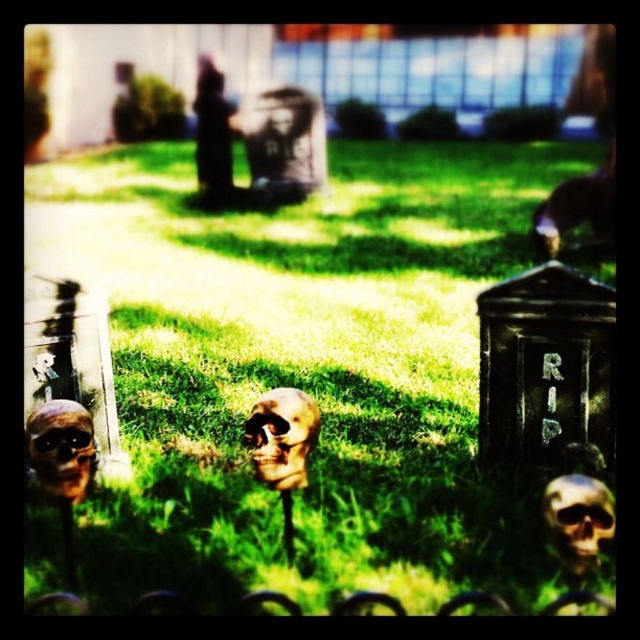
Question: Which point appears closest to the camera in this image?

Choices:
 (A) (74, 500)
 (B) (282, 435)
 (C) (378, 296)

Answer: (B)

Question: Based on their relative distances, which object is farther from the gold metallic skull at center?

Choices:
 (A) green grass at center
 (B) gold metallic skull at lower center
 (C) brown matte skull at center

Answer: (A)

Question: Where is green grass at center located in relation to gold metallic skull at center in the image?

Choices:
 (A) left
 (B) right

Answer: (B)

Question: From the image, what is the correct spatial relationship of brown matte skull at center in relation to gold metallic skull at lower center?

Choices:
 (A) right
 (B) left

Answer: (B)

Question: Which point is closer to the camera?

Choices:
 (A) (259, 426)
 (B) (45, 456)
 (C) (609, 508)
 (D) (237, 260)

Answer: (C)

Question: Is brown matte skull at center closer to camera compared to gold metallic skull at center?

Choices:
 (A) no
 (B) yes

Answer: (A)